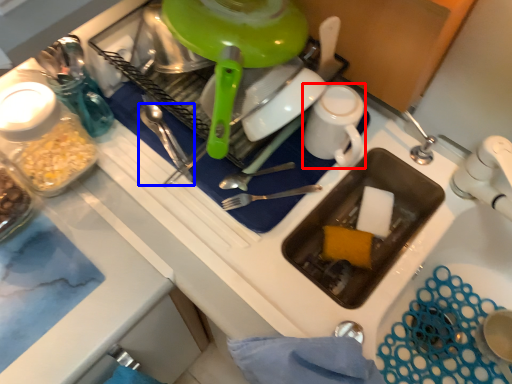
Question: Which point is further to the camera, tableware (highlighted by a red box) or silverware (highlighted by a blue box)?

Choices:
 (A) tableware
 (B) silverware

Answer: (B)